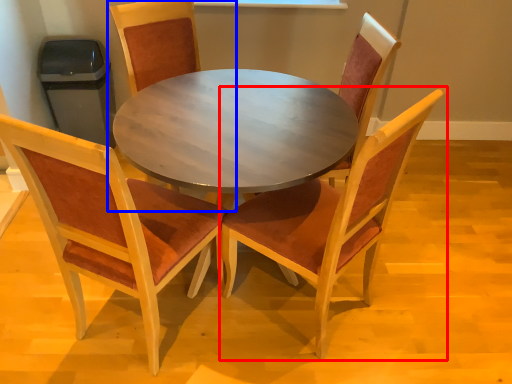
Question: Which object is closer to the camera taking this photo, chair (highlighted by a red box) or chair (highlighted by a blue box)?

Choices:
 (A) chair
 (B) chair

Answer: (A)